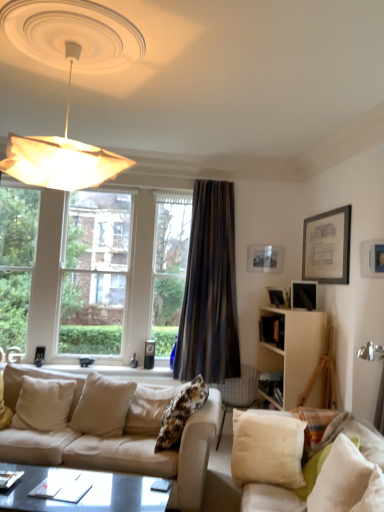
Where is `vacant area on top of white fabric lampshade at upper left (from a real-world perspective)`? vacant area on top of white fabric lampshade at upper left (from a real-world perspective) is located at coordinates (56, 21).